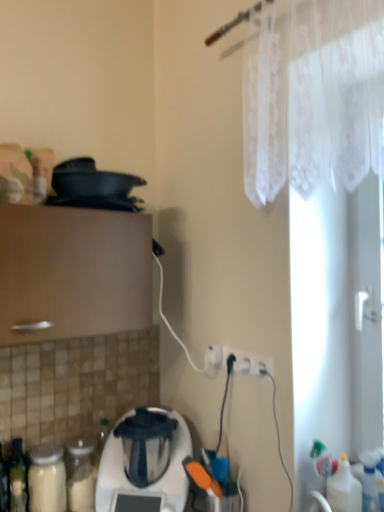
Image resolution: width=384 pixels, height=512 pixels. What are the coordinates of `translucent plastic bottle at lower right` in the screenshot? It's located at (344, 489).

This screenshot has height=512, width=384. Describe the element at coordinates (145, 463) in the screenshot. I see `white plastic blender at lower center` at that location.

The width and height of the screenshot is (384, 512). In order to click on white plastic blender at lower center in this screenshot , I will do `click(145, 463)`.

The width and height of the screenshot is (384, 512). I want to click on translucent plastic bottle at lower right, so click(344, 489).

Is white plastic electric outlet at lower center located outside white lace curtain at upper right?

Absolutely, white plastic electric outlet at lower center is external to white lace curtain at upper right.

Can you confirm if white plastic electric outlet at lower center is positioned to the right of white lace curtain at upper right?

No.

Considering the sizes of objects white plastic electric outlet at lower center and white lace curtain at upper right in the image provided, who is shorter, white plastic electric outlet at lower center or white lace curtain at upper right?

With less height is white plastic electric outlet at lower center.

Considering the relative sizes of translucent plastic bottle at lower right and white plastic blender at lower center in the image provided, is translucent plastic bottle at lower right wider than white plastic blender at lower center?

Incorrect, the width of translucent plastic bottle at lower right does not surpass that of white plastic blender at lower center.

Is translucent plastic bottle at lower right oriented away from white plastic blender at lower center?

No, white plastic blender at lower center is not at the back of translucent plastic bottle at lower right.

Choose the correct answer: Is translucent plastic bottle at lower right inside white plastic blender at lower center or outside it?

translucent plastic bottle at lower right is located beyond the bounds of white plastic blender at lower center.

Image resolution: width=384 pixels, height=512 pixels. In order to click on bottle on the right of the white plastic blender at lower center in this screenshot , I will do `click(344, 489)`.

Find the location of a particular element. This screenshot has width=384, height=512. home appliance on the left of white plastic electric outlet at lower center is located at coordinates (145, 463).

Does white plastic blender at lower center have a greater height compared to white plastic electric outlet at lower center?

Correct, white plastic blender at lower center is much taller as white plastic electric outlet at lower center.

Is point (156, 435) closer to camera compared to point (242, 355)?

No, it is not.

Between white plastic blender at lower center and white plastic electric outlet at lower center, which one has larger size?

With larger size is white plastic blender at lower center.

Is white plastic blender at lower center located within white plastic electric outlet at lower center?

Definitely not — white plastic blender at lower center is not inside white plastic electric outlet at lower center.

Is the depth of white plastic electric outlet at lower center less than that of white plastic blender at lower center?

No, white plastic electric outlet at lower center is further to the viewer.

How many degrees apart are the facing directions of white plastic electric outlet at lower center and white plastic blender at lower center?

white plastic electric outlet at lower center and white plastic blender at lower center are facing 130 degrees away from each other.

Can you confirm if white plastic electric outlet at lower center is bigger than white plastic blender at lower center?

No, white plastic electric outlet at lower center is not bigger than white plastic blender at lower center.

Does white plastic blender at lower center lie behind translucent plastic bottle at lower right?

That is True.

From the image's perspective, relative to translucent plastic bottle at lower right, is white plastic blender at lower center above or below?

white plastic blender at lower center is below translucent plastic bottle at lower right.

Considering the points (129, 429) and (356, 490), which point is in front, point (129, 429) or point (356, 490)?

Point (356, 490)

Is white lace curtain at upper right situated inside white plastic electric outlet at lower center or outside?

white lace curtain at upper right cannot be found inside white plastic electric outlet at lower center.

Which object is closer to the camera taking this photo, white lace curtain at upper right or white plastic electric outlet at lower center?

white lace curtain at upper right is closer to the camera.

Is white lace curtain at upper right far away from white plastic electric outlet at lower center?

white lace curtain at upper right is near white plastic electric outlet at lower center, not far away.

From the image's perspective, is translucent plastic bottle at lower right beneath white lace curtain at upper right?

Yes, from the image's perspective, translucent plastic bottle at lower right is below white lace curtain at upper right.

What's the angular difference between translucent plastic bottle at lower right and white lace curtain at upper right's facing directions?

The angle between the facing direction of translucent plastic bottle at lower right and the facing direction of white lace curtain at upper right is 178 degrees.

Considering the sizes of objects translucent plastic bottle at lower right and white lace curtain at upper right in the image provided, who is bigger, translucent plastic bottle at lower right or white lace curtain at upper right?

white lace curtain at upper right.

Is translucent plastic bottle at lower right in front of white lace curtain at upper right?

No, it is behind white lace curtain at upper right.

Image resolution: width=384 pixels, height=512 pixels. In order to click on electric outlet on the left of white lace curtain at upper right in this screenshot , I will do `click(248, 362)`.

Identify the location of bottle that appears on the right of white plastic blender at lower center. (344, 489).

When comparing their distances from white lace curtain at upper right, does white plastic electric outlet at lower center or white plastic blender at lower center seem closer?

white plastic electric outlet at lower center is closer to white lace curtain at upper right.

Looking at the image, which one is located closer to translucent plastic bottle at lower right, white plastic blender at lower center or white lace curtain at upper right?

white plastic blender at lower center.

Estimate the real-world distances between objects in this image. Which object is closer to white plastic blender at lower center, translucent plastic bottle at lower right or white lace curtain at upper right?

translucent plastic bottle at lower right is positioned closer to the anchor white plastic blender at lower center.

Which object lies further to the anchor point translucent plastic bottle at lower right, white plastic electric outlet at lower center or white lace curtain at upper right?

white lace curtain at upper right is further to translucent plastic bottle at lower right.

Based on their spatial positions, is white lace curtain at upper right or white plastic blender at lower center closer to white plastic electric outlet at lower center?

The object closer to white plastic electric outlet at lower center is white plastic blender at lower center.

Looking at the image, which one is located further to white plastic blender at lower center, white plastic electric outlet at lower center or translucent plastic bottle at lower right?

translucent plastic bottle at lower right.

Considering their positions, is translucent plastic bottle at lower right positioned closer to white plastic electric outlet at lower center than white plastic blender at lower center?

The object closer to white plastic electric outlet at lower center is translucent plastic bottle at lower right.

Consider the image. Looking at the image, which one is located closer to white plastic electric outlet at lower center, white plastic blender at lower center or translucent plastic bottle at lower right?

translucent plastic bottle at lower right.

Find the location of `bottle that lies between white lace curtain at upper right and white plastic blender at lower center from top to bottom`. bottle that lies between white lace curtain at upper right and white plastic blender at lower center from top to bottom is located at coordinates (344, 489).

The width and height of the screenshot is (384, 512). What are the coordinates of `electric outlet between white plastic blender at lower center and translucent plastic bottle at lower right in the horizontal direction` in the screenshot? It's located at (248, 362).

Identify the location of electric outlet that lies between white lace curtain at upper right and translucent plastic bottle at lower right from top to bottom. This screenshot has height=512, width=384. (248, 362).

Identify the location of electric outlet between white lace curtain at upper right and white plastic blender at lower center in the up-down direction. (248, 362).